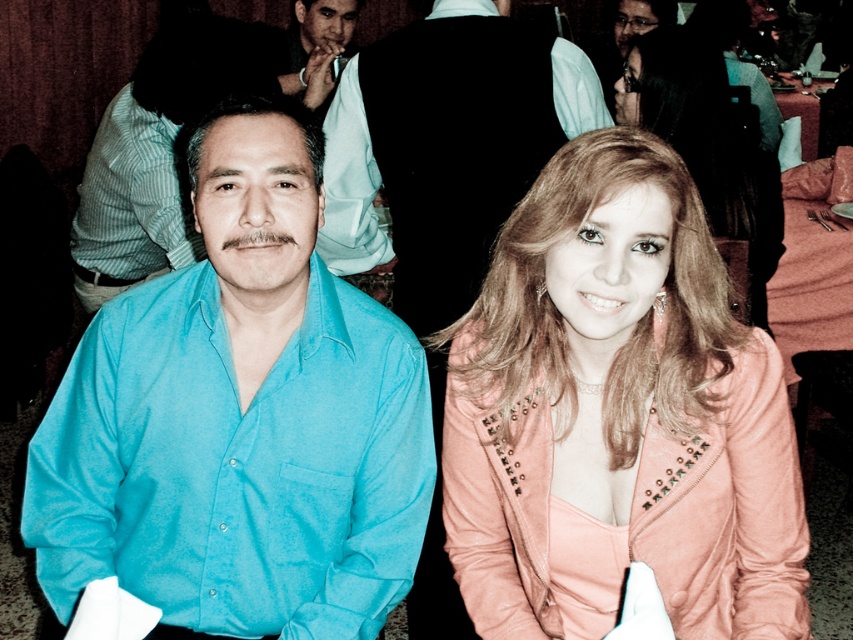
Question: Which object appears farthest from the camera in this image?

Choices:
 (A) shiny pink jacket at center
 (B) peach suede jacket at right
 (C) turquoise fabric shirt at left

Answer: (A)

Question: Estimate the real-world distances between objects in this image. Which object is farther from the shiny pink jacket at center?

Choices:
 (A) turquoise shirt at center
 (B) peach suede jacket at right
 (C) teal smooth shirt at left
 (D) turquoise fabric shirt at left

Answer: (C)

Question: From the image, what is the correct spatial relationship of turquoise shirt at center in relation to shiny pink jacket at center?

Choices:
 (A) above
 (B) below

Answer: (B)

Question: Is teal smooth shirt at left thinner than shiny pink jacket at center?

Choices:
 (A) yes
 (B) no

Answer: (B)

Question: Can you confirm if teal smooth shirt at left is positioned to the left of shiny pink jacket at center?

Choices:
 (A) no
 (B) yes

Answer: (B)

Question: Which of these objects is positioned closest to the turquoise fabric shirt at left?

Choices:
 (A) shiny pink jacket at center
 (B) turquoise shirt at center

Answer: (A)